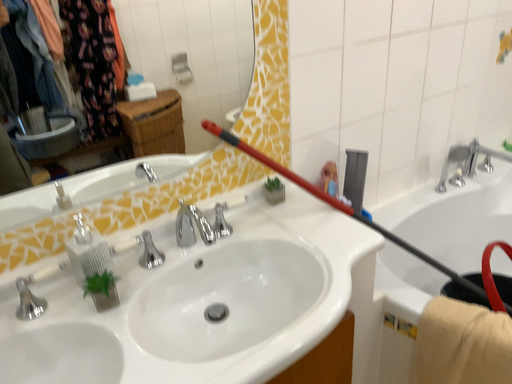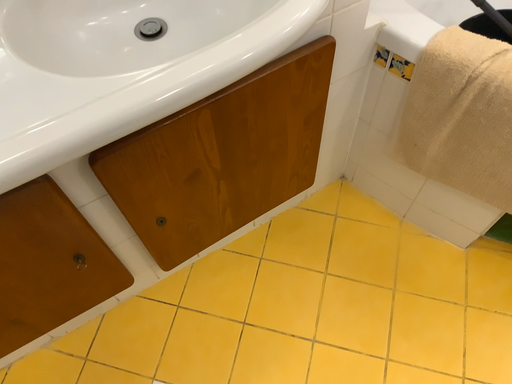
Question: How did the camera likely rotate when shooting the video?

Choices:
 (A) rotated downward
 (B) rotated upward

Answer: (A)